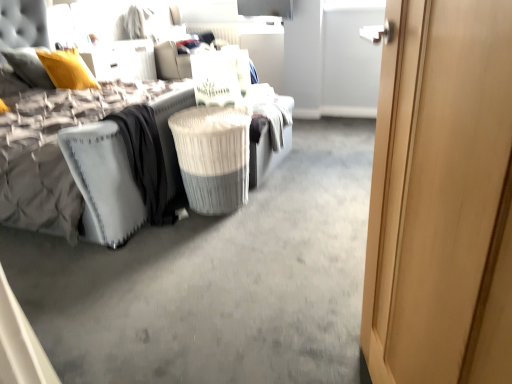
Locate an element on the screen. This screenshot has width=512, height=384. white wicker laundry basket at center is located at coordinates (213, 157).

Where is `light wood door at right`? Image resolution: width=512 pixels, height=384 pixels. light wood door at right is located at coordinates tap(442, 197).

The width and height of the screenshot is (512, 384). Describe the element at coordinates (166, 157) in the screenshot. I see `velvet grey bed at center` at that location.

Where is `white textured mattress at left`? Image resolution: width=512 pixels, height=384 pixels. white textured mattress at left is located at coordinates (103, 173).

Locate an element on the screen. This screenshot has width=512, height=384. white wicker laundry basket at center is located at coordinates (213, 157).

Which of these two, velvet grey bed at center or white wicker laundry basket at center, is smaller?

Smaller between the two is white wicker laundry basket at center.

Is velvet grey bed at center oriented towards white wicker laundry basket at center?

Yes, velvet grey bed at center faces towards white wicker laundry basket at center.

How different are the orientations of velvet grey bed at center and white wicker laundry basket at center in degrees?

The facing directions of velvet grey bed at center and white wicker laundry basket at center are 0.194 degrees apart.

Based on the photo, is velvet grey bed at center completely or partially outside of white wicker laundry basket at center?

velvet grey bed at center lies outside white wicker laundry basket at center's area.

In the image, is white wicker laundry basket at center on the left side or the right side of white textured mattress at left?

From the image, it's evident that white wicker laundry basket at center is to the right of white textured mattress at left.

From the picture: Do you think white wicker laundry basket at center is within white textured mattress at left, or outside of it?

white wicker laundry basket at center cannot be found inside white textured mattress at left.

From the image's perspective, would you say white wicker laundry basket at center is shown under white textured mattress at left?

No, from the image's perspective, white wicker laundry basket at center is not beneath white textured mattress at left.

In the image, there is a light wood door at right. Where is `laundry basket above it (from the image's perspective)`? This screenshot has height=384, width=512. laundry basket above it (from the image's perspective) is located at coordinates (213, 157).

Which is in front, light wood door at right or white wicker laundry basket at center?

light wood door at right is more forward.

Is light wood door at right next to white wicker laundry basket at center?

light wood door at right and white wicker laundry basket at center are not in contact.

From the image's perspective, relative to white wicker laundry basket at center, is light wood door at right above or below?

light wood door at right is below white wicker laundry basket at center.

Is white wicker laundry basket at center oriented away from velvet grey bed at center?

Yes, white wicker laundry basket at center is positioned with its back facing velvet grey bed at center.

From the picture: From the image's perspective, is white wicker laundry basket at center located beneath velvet grey bed at center?

Indeed, from the image's perspective, white wicker laundry basket at center is shown beneath velvet grey bed at center.

Consider the image. Considering the relative sizes of white wicker laundry basket at center and velvet grey bed at center in the image provided, is white wicker laundry basket at center wider than velvet grey bed at center?

In fact, white wicker laundry basket at center might be narrower than velvet grey bed at center.

Considering the sizes of objects white wicker laundry basket at center and velvet grey bed at center in the image provided, who is shorter, white wicker laundry basket at center or velvet grey bed at center?

With less height is white wicker laundry basket at center.

Is white textured mattress at left oriented away from light wood door at right?

No, white textured mattress at left's orientation is not away from light wood door at right.

Is white textured mattress at left smaller than light wood door at right?

Actually, white textured mattress at left might be larger than light wood door at right.

Is white textured mattress at left thinner than light wood door at right?

In fact, white textured mattress at left might be wider than light wood door at right.

From a real-world perspective, does white textured mattress at left sit lower than light wood door at right?

Yes, from a real-world perspective, white textured mattress at left is beneath light wood door at right.

Is velvet grey bed at center to the left or to the right of white textured mattress at left in the image?

Clearly, velvet grey bed at center is on the left of white textured mattress at left in the image.

I want to click on mattress that is behind the velvet grey bed at center, so click(103, 173).

Which object is thinner, velvet grey bed at center or white textured mattress at left?

white textured mattress at left is thinner.

From the image's perspective, which object appears higher, velvet grey bed at center or light wood door at right?

velvet grey bed at center is shown above in the image.

Locate an element on the screen. Image resolution: width=512 pixels, height=384 pixels. bed on the left of light wood door at right is located at coordinates (166, 157).

Relative to light wood door at right, is velvet grey bed at center in front or behind?

Clearly, velvet grey bed at center is behind light wood door at right.

Based on the photo, looking at their sizes, would you say velvet grey bed at center is wider or thinner than light wood door at right?

velvet grey bed at center is wider than light wood door at right.

Locate an element on the screen. This screenshot has width=512, height=384. laundry basket behind the velvet grey bed at center is located at coordinates (213, 157).

Locate an element on the screen. The height and width of the screenshot is (384, 512). laundry basket below the white textured mattress at left (from a real-world perspective) is located at coordinates (213, 157).

Which object lies nearer to the anchor point white textured mattress at left, velvet grey bed at center or white wicker laundry basket at center?

velvet grey bed at center is positioned closer to the anchor white textured mattress at left.

Based on their spatial positions, is velvet grey bed at center or white textured mattress at left further from light wood door at right?

velvet grey bed at center.

Based on their spatial positions, is white textured mattress at left or white wicker laundry basket at center further from velvet grey bed at center?

Among the two, white textured mattress at left is located further to velvet grey bed at center.

From the image, which object appears to be nearer to white wicker laundry basket at center, white textured mattress at left or velvet grey bed at center?

Based on the image, velvet grey bed at center appears to be nearer to white wicker laundry basket at center.

Considering their positions, is white wicker laundry basket at center positioned closer to light wood door at right than velvet grey bed at center?

Based on the image, white wicker laundry basket at center appears to be nearer to light wood door at right.

Which object lies further to the anchor point light wood door at right, velvet grey bed at center or white wicker laundry basket at center?

The object further to light wood door at right is velvet grey bed at center.

From the image, which object appears to be nearer to light wood door at right, white textured mattress at left or velvet grey bed at center?

white textured mattress at left lies closer to light wood door at right than the other object.

Which object lies further to the anchor point white wicker laundry basket at center, light wood door at right or velvet grey bed at center?

light wood door at right.

Where is `laundry basket located between velvet grey bed at center and light wood door at right in the left-right direction`? This screenshot has width=512, height=384. laundry basket located between velvet grey bed at center and light wood door at right in the left-right direction is located at coordinates (213, 157).

This screenshot has height=384, width=512. I want to click on mattress situated between velvet grey bed at center and light wood door at right from left to right, so [x=103, y=173].

At what (x,y) coordinates should I click in order to perform the action: click on mattress between velvet grey bed at center and white wicker laundry basket at center. Please return your answer as a coordinate pair (x, y). The height and width of the screenshot is (384, 512). Looking at the image, I should click on (103, 173).

The image size is (512, 384). I want to click on mattress between light wood door at right and white wicker laundry basket at center from front to back, so click(x=103, y=173).